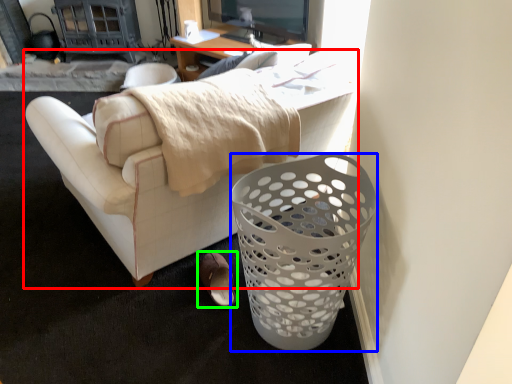
Question: Which is nearer to the studio couch (highlighted by a red box)? trash bin/can (highlighted by a blue box) or footwear (highlighted by a green box).

Choices:
 (A) trash bin/can
 (B) footwear

Answer: (A)